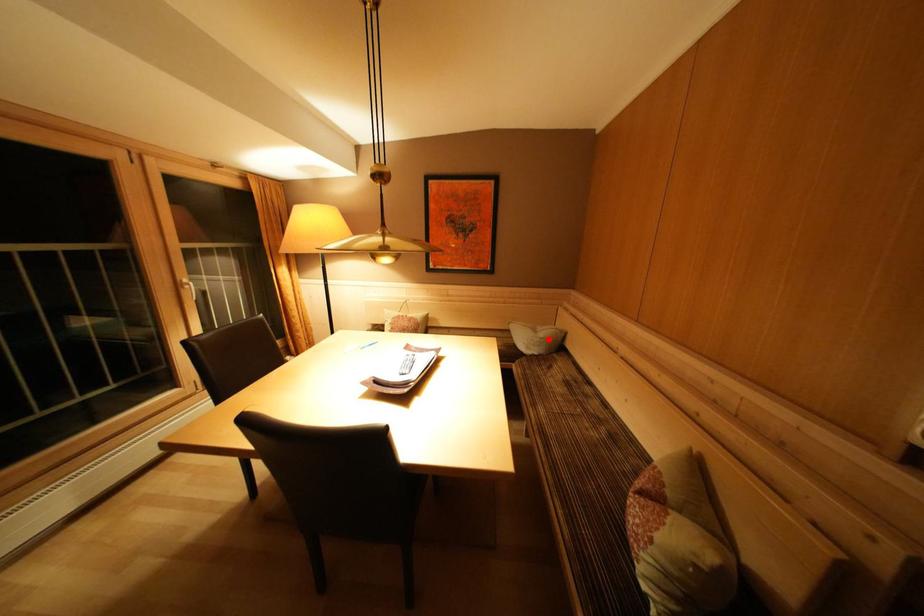
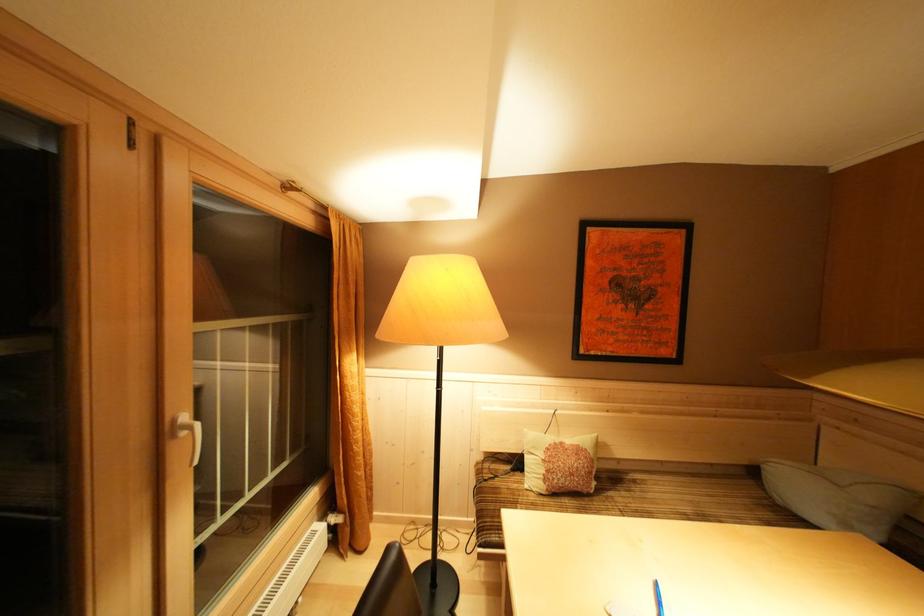
Locate, in the second image, the point that corresponds to the highlighted location in the first image.

(879, 503)